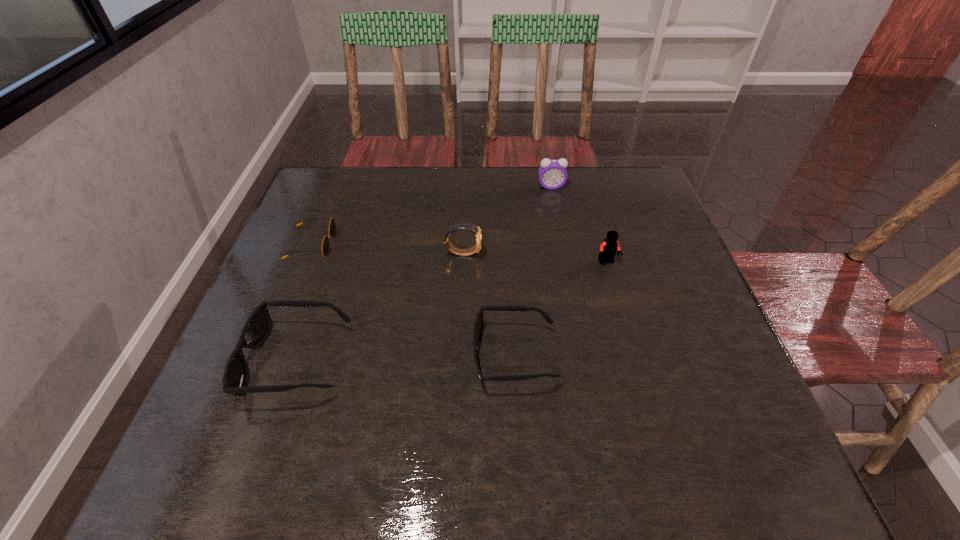
In the image, there is a desktop. Identify the location of free space at the near edge. (638, 417).

The height and width of the screenshot is (540, 960). What are the coordinates of `vacant space at the left edge` in the screenshot? It's located at (313, 313).

Where is `free location at the right edge of the desktop`? The width and height of the screenshot is (960, 540). free location at the right edge of the desktop is located at coordinates (641, 238).

Identify the location of free region at the far left corner. This screenshot has width=960, height=540. (328, 197).

I want to click on free space at the far right corner of the desktop, so click(x=610, y=176).

The height and width of the screenshot is (540, 960). I want to click on vacant region between the second tallest sunglasses and the shortest sunglasses, so click(413, 300).

I want to click on vacant space in between the shortest sunglasses and the second tallest sunglasses, so click(413, 300).

Identify the location of free area in between the Lego and the fourth tallest object. (451, 311).

In order to click on empty space between the fifth object from left to right and the rightmost sunglasses in this screenshot , I will do `click(533, 271)`.

Find the location of a particular element. The image size is (960, 540). vacant space in between the alarm clock and the fifth tallest object is located at coordinates (533, 271).